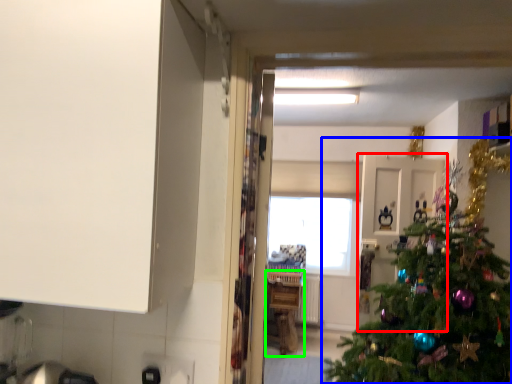
Question: Considering the real-world distances, which object is closest to door (highlighted by a red box)? christmas tree (highlighted by a blue box) or counter (highlighted by a green box).

Choices:
 (A) christmas tree
 (B) counter

Answer: (A)